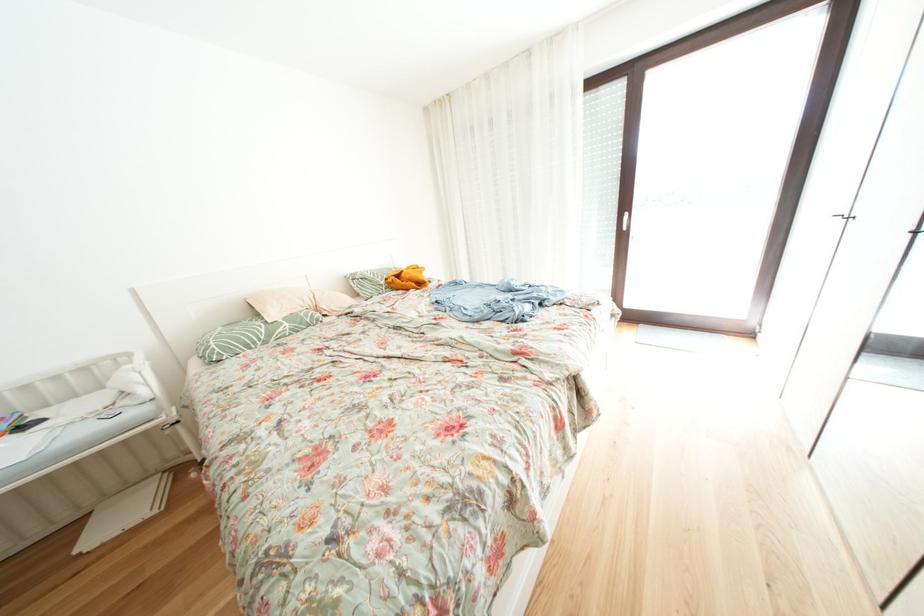
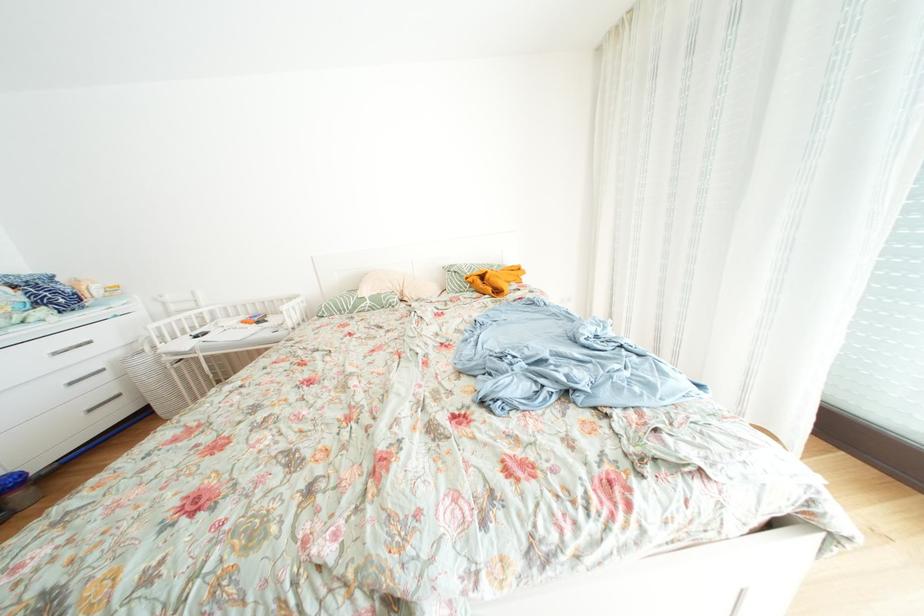
Question: The camera is either moving clockwise (left) or counter-clockwise (right) around the object. The first image is from the beginning of the video and the second image is from the end. Is the camera moving left or right when shooting the video?

Choices:
 (A) Left
 (B) Right

Answer: (B)